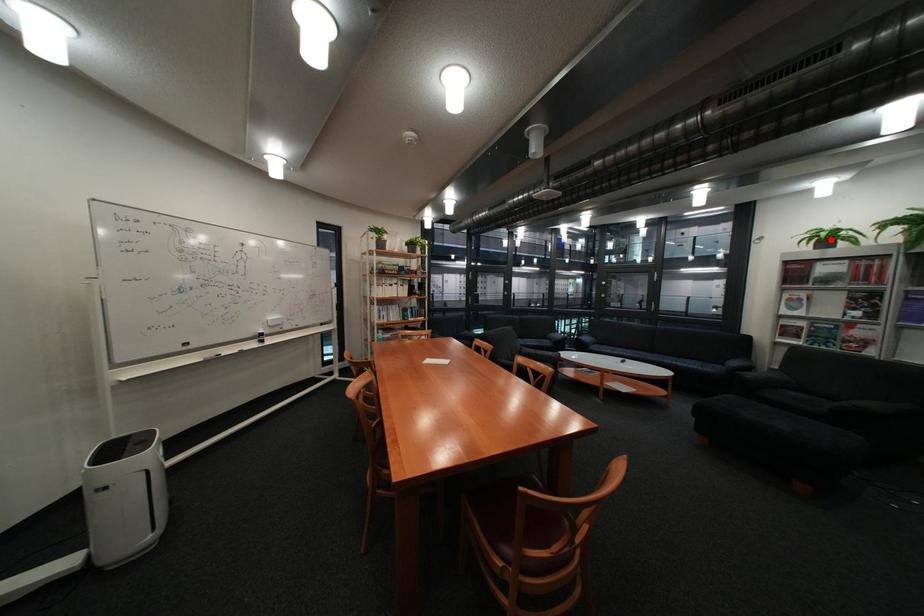
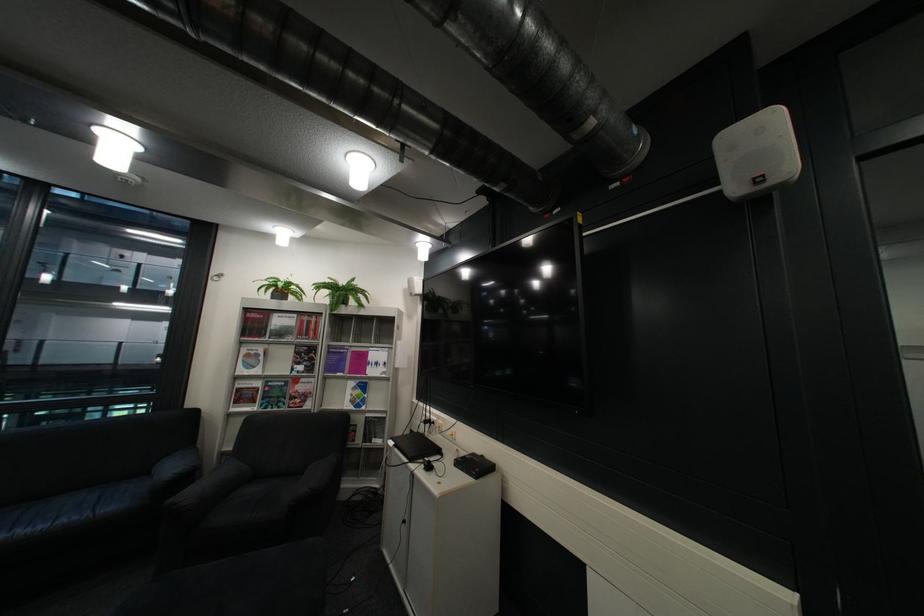
Question: I am providing you with two images of the same scene from different viewpoints. A red point is marked on the first image. At the location where the point appears in image 1, is it still visible in image 2?

Choices:
 (A) Yes
 (B) No

Answer: (A)